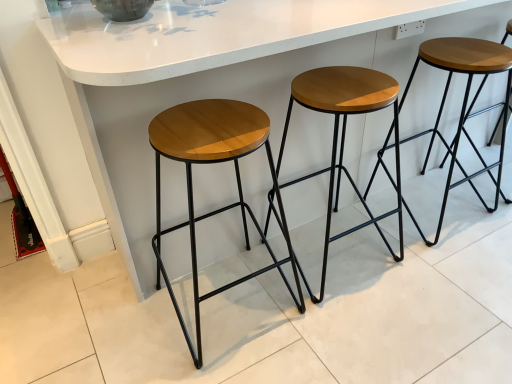
The height and width of the screenshot is (384, 512). Find the location of `vacant area that lies to the right of wooden/matte stool at center, the third stool from the right`. vacant area that lies to the right of wooden/matte stool at center, the third stool from the right is located at coordinates (343, 327).